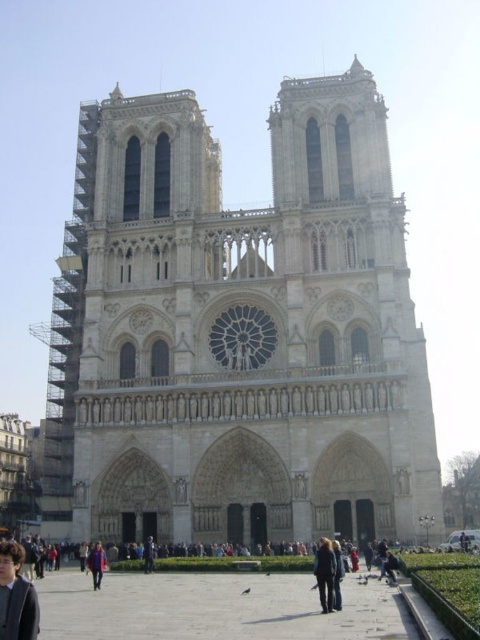
You are a tourist standing in the square in front of Notre Dame Cathedral. You see the white stone tower at center and the blue denim jacket at lower center. Which object is positioned to the right of the other?

The white stone tower at center is to the right of the blue denim jacket at lower center.

You are standing in front of the Notre Dame Cathedral and want to take a photo of both the white stone tower at center and the dark brown hair at lower left. Which object should you adjust your camera focus on first to ensure both are in the frame?

The white stone tower at center is further to the viewer than the dark brown hair at lower left, so you should focus on the white stone tower at center first to ensure both are in the frame.

You are a tourist standing in the square in front of Notre Dame Cathedral. You see the white stone tower at center and the dark brown hair at lower left. Which object is higher in the image?

The white stone tower at center is higher than the dark brown hair at lower left because it is positioned above it in the image.